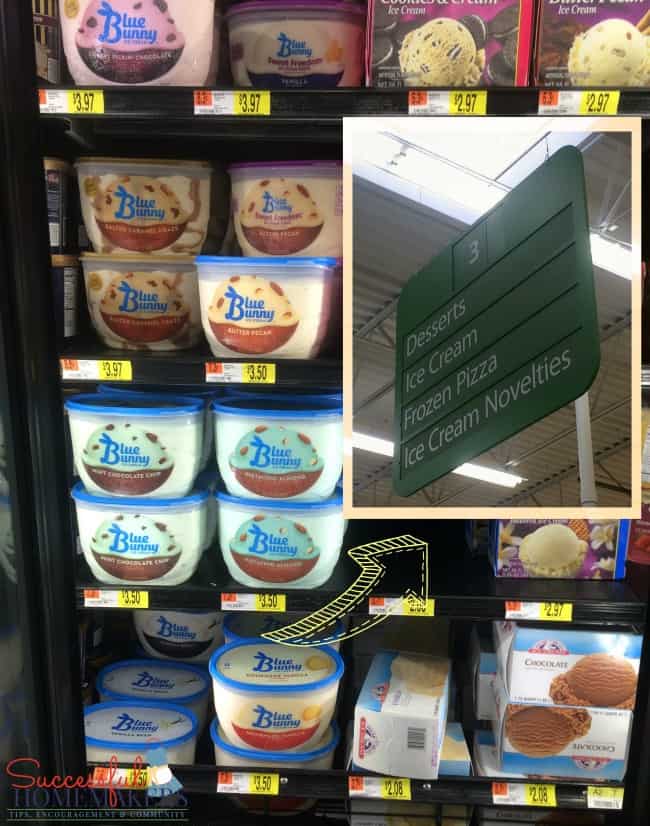
Find the location of `shelf`. shelf is located at coordinates (335, 97), (304, 377), (463, 613), (450, 787).